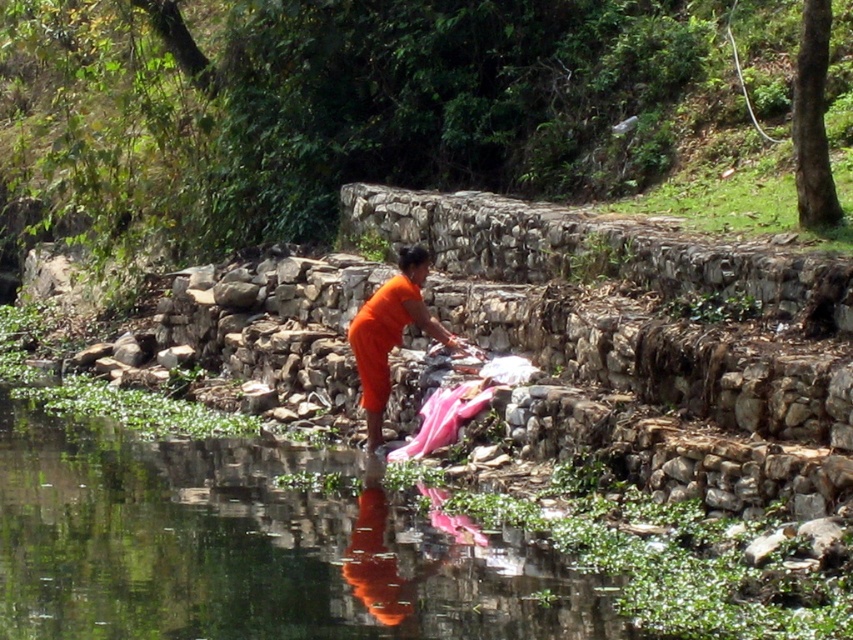
Question: In this image, where is orange fabric at center located relative to orange matte cloth at center?

Choices:
 (A) left
 (B) right

Answer: (B)

Question: Is orange fabric at center bigger than orange matte cloth at center?

Choices:
 (A) yes
 (B) no

Answer: (A)

Question: Which point is closer to the camera?

Choices:
 (A) orange matte cloth at center
 (B) orange fabric at center

Answer: (A)

Question: Which object appears farthest from the camera in this image?

Choices:
 (A) orange matte cloth at center
 (B) orange fabric at center

Answer: (B)

Question: Which of the following is the closest to the observer?

Choices:
 (A) (363, 328)
 (B) (401, 330)

Answer: (A)

Question: Can you confirm if orange fabric at center is positioned above orange matte cloth at center?

Choices:
 (A) yes
 (B) no

Answer: (B)